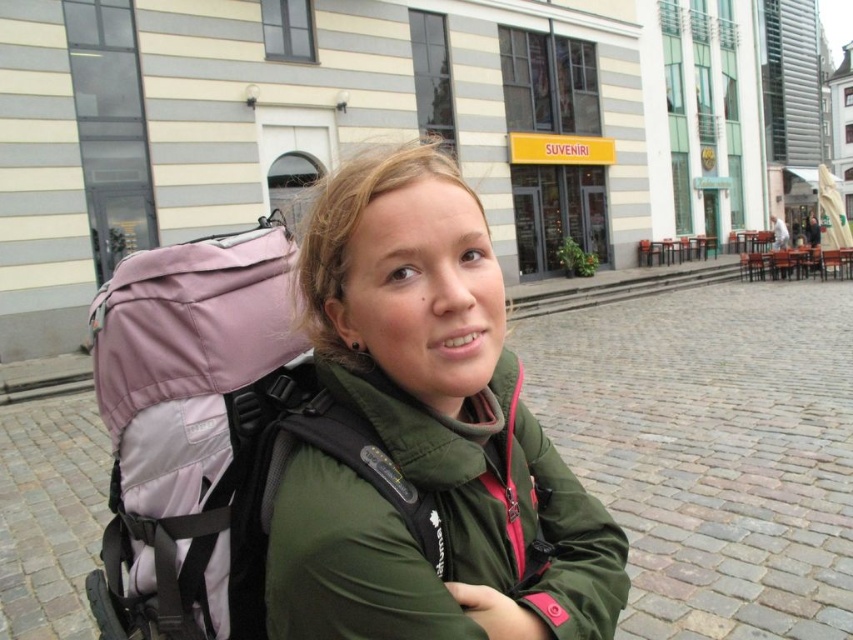
Question: Which of the following is the closest to the observer?

Choices:
 (A) pos(90,317)
 (B) pos(540,497)

Answer: (B)

Question: Does green matte jacket at center come in front of pink fabric backpack at left?

Choices:
 (A) no
 (B) yes

Answer: (B)

Question: In this image, where is green matte jacket at center located relative to pink fabric backpack at left?

Choices:
 (A) above
 (B) below

Answer: (A)

Question: Does green matte jacket at center have a greater width compared to pink fabric backpack at left?

Choices:
 (A) yes
 (B) no

Answer: (A)